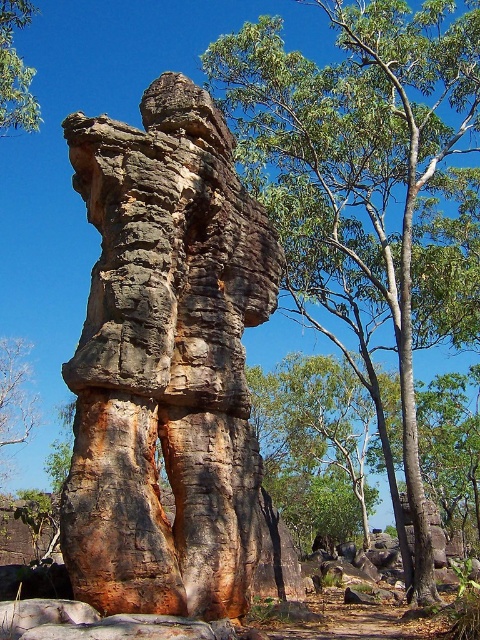
You are a geologist examining the rustic stone sculpture at center. Based on its position at coordinates 0.566, 0.346, can you determine if it is positioned closer to the top or bottom of the image?

The rustic stone sculpture at center is located at point (166, 362). Since the y coordinate is 0.346, which is closer to 0.5 than 0, it is positioned closer to the bottom of the image.